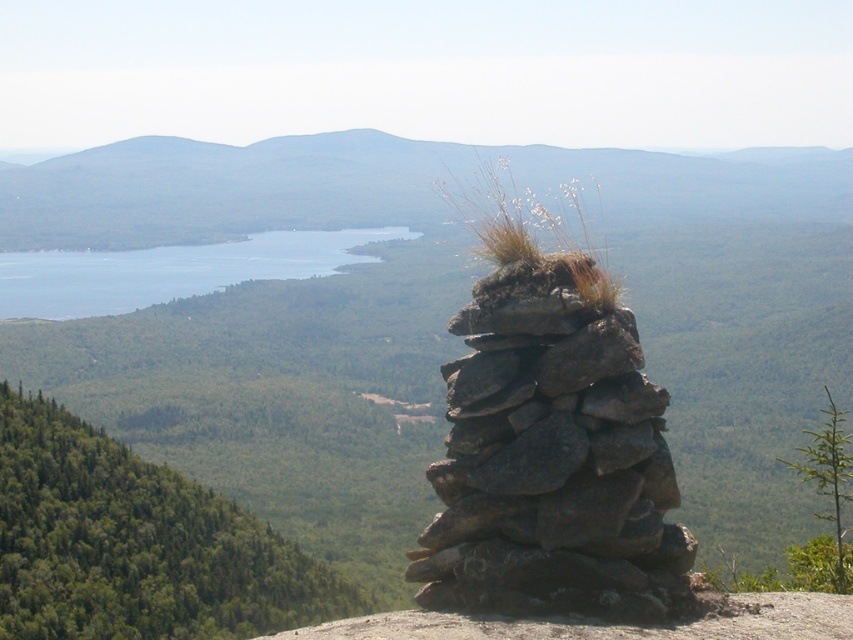
You are planning to build a small garden in your backyard. You have two options for the central feature of your garden design. The first option is a rocky outcrop at center, and the second is a blue water at center. Based on the scene description provided, which of these two options would occupy more space in your garden?

The rocky outcrop at center has a larger size compared to blue water at center, so the rocky outcrop at center would occupy more space in the garden.

You are hiking and want to take a photo of the gray rough stone stack at center and the rocky outcrop at center. Which one should you focus on first if you want both to be in clear view?

You should focus on the gray rough stone stack at center first because it is closer to you than the rocky outcrop at center, ensuring both are in focus when using depth of field.

You are a hiker who wants to place a GPS tracker on the tallest object between the gray rough stone stack at center and the rocky outcrop at center. Which object should you choose?

The rocky outcrop at center is taller than the gray rough stone stack at center, so you should place the GPS tracker on the rocky outcrop at center.